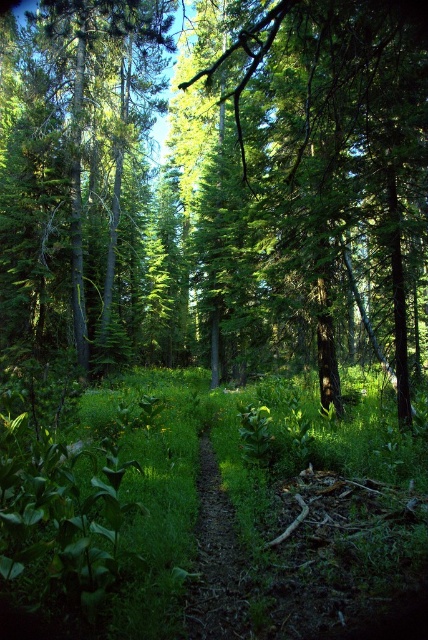
Question: Which point is farther from the camera taking this photo?

Choices:
 (A) (303, 532)
 (B) (219, 570)
 (C) (124, 86)
 (D) (416, 13)

Answer: (C)

Question: Is green leafy grass at center smaller than green matte tree at left?

Choices:
 (A) yes
 (B) no

Answer: (A)

Question: Among these objects, which one is farthest from the camera?

Choices:
 (A) green leafy grass at center
 (B) dirt path at center
 (C) green matte tree at left

Answer: (C)

Question: Which point is farther to the camera?

Choices:
 (A) (255, 54)
 (B) (26, 296)
 (C) (246, 624)
 (D) (267, 484)

Answer: (B)

Question: Can you confirm if green leafy grass at center is positioned below green leafy tree at center?

Choices:
 (A) no
 (B) yes

Answer: (B)

Question: In this image, where is green matte tree at left located relative to dirt path at center?

Choices:
 (A) below
 (B) above

Answer: (B)